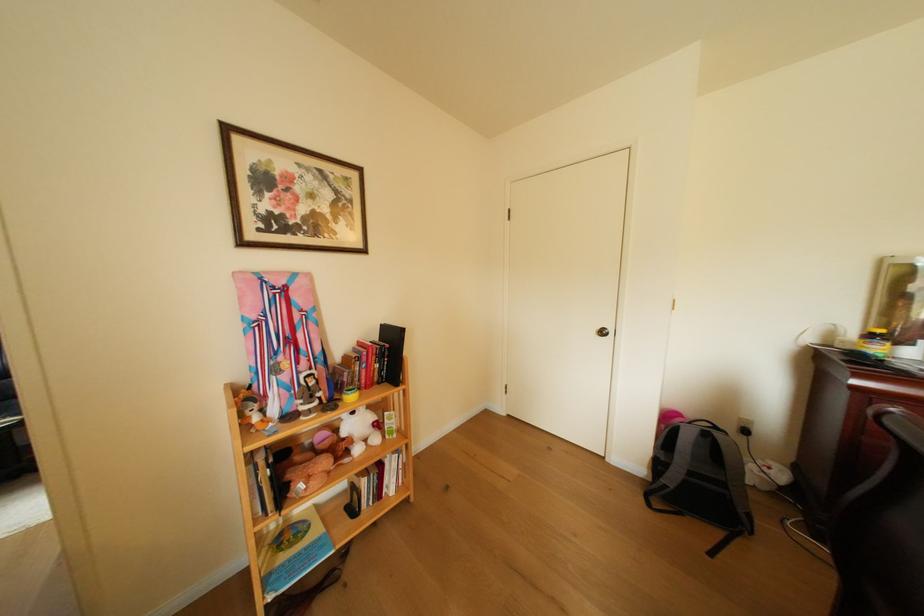
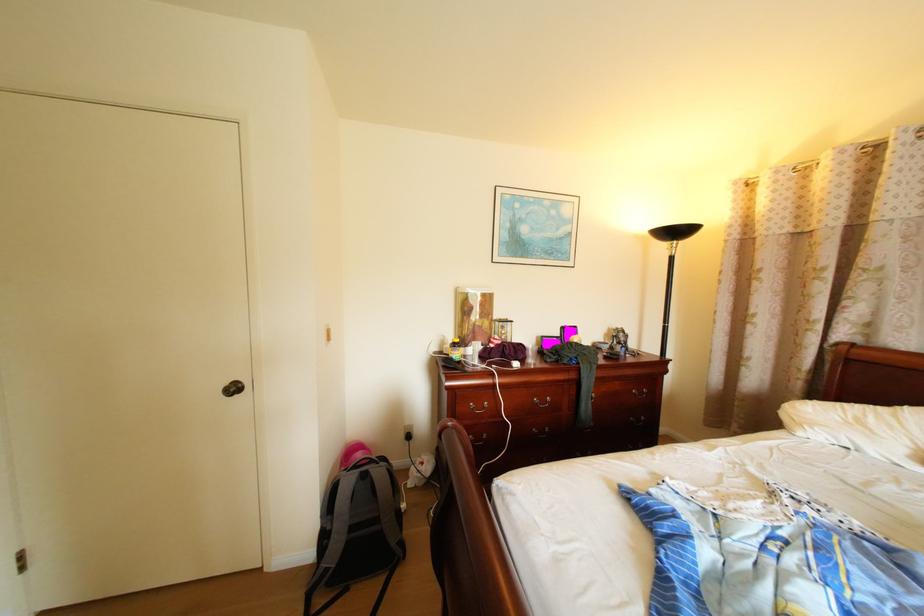
Locate, in the second image, the point that corresponds to (x=675, y=460) in the first image.

(342, 529)